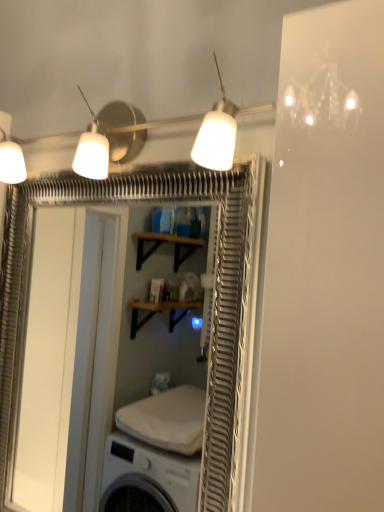
Question: In terms of height, does white matte lampshade at upper center look taller or shorter compared to white glossy screen door at upper center?

Choices:
 (A) short
 (B) tall

Answer: (A)

Question: Is point 200,152 positioned closer to the camera than point 226,217?

Choices:
 (A) farther
 (B) closer

Answer: (B)

Question: From the image's perspective, is white matte lampshade at upper center positioned above or below white glossy screen door at upper center?

Choices:
 (A) above
 (B) below

Answer: (A)

Question: Looking at their shapes, would you say white glossy screen door at upper center is wider or thinner than white matte lampshade at upper center?

Choices:
 (A) wide
 (B) thin

Answer: (B)

Question: From a real-world perspective, relative to white matte lampshade at upper center, is white glossy screen door at upper center vertically above or below?

Choices:
 (A) above
 (B) below

Answer: (B)

Question: From their relative heights in the image, would you say white glossy screen door at upper center is taller or shorter than white matte lampshade at upper center?

Choices:
 (A) short
 (B) tall

Answer: (B)

Question: Visually, is white glossy screen door at upper center positioned to the left or to the right of white matte lampshade at upper center?

Choices:
 (A) right
 (B) left

Answer: (B)